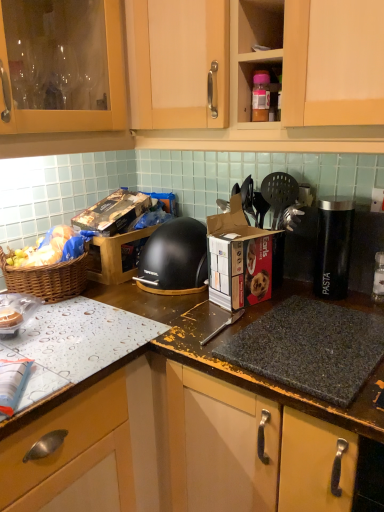
Question: Could you tell me if cardboard box at center, acting as the second cardboard box starting from the back, is facing matte wood cabinet at upper center?

Choices:
 (A) no
 (B) yes

Answer: (A)

Question: Is cardboard box at center, acting as the second cardboard box starting from the back, to the right of matte wood cabinet at upper center from the viewer's perspective?

Choices:
 (A) no
 (B) yes

Answer: (A)

Question: Is matte wood cabinet at upper center completely or partially inside cardboard box at center, which ranks as the 2th cardboard box in left-to-right order?

Choices:
 (A) yes
 (B) no

Answer: (B)

Question: Is cardboard box at center, which appears as the first cardboard box when viewed from the right, not near matte wood cabinet at upper center?

Choices:
 (A) no
 (B) yes

Answer: (A)

Question: Does cardboard box at center, which ranks as the 2th cardboard box in left-to-right order, lie in front of matte wood cabinet at upper center?

Choices:
 (A) yes
 (B) no

Answer: (B)

Question: Visually, is woven brown picnic basket at left positioned to the left or to the right of black plastic canister at right?

Choices:
 (A) right
 (B) left

Answer: (B)

Question: From the image's perspective, relative to black plastic canister at right, is woven brown picnic basket at left above or below?

Choices:
 (A) above
 (B) below

Answer: (B)

Question: From a real-world perspective, relative to black plastic canister at right, is woven brown picnic basket at left vertically above or below?

Choices:
 (A) below
 (B) above

Answer: (A)

Question: Does point (84, 274) appear closer or farther from the camera than point (329, 296)?

Choices:
 (A) closer
 (B) farther

Answer: (B)

Question: From a real-world perspective, relative to black plastic spatula at upper right, is matte wood cabinet at upper center vertically above or below?

Choices:
 (A) below
 (B) above

Answer: (B)

Question: Is matte wood cabinet at upper center taller or shorter than black plastic spatula at upper right?

Choices:
 (A) short
 (B) tall

Answer: (B)

Question: Relative to black plastic spatula at upper right, is matte wood cabinet at upper center in front or behind?

Choices:
 (A) front
 (B) behind

Answer: (A)

Question: Is matte wood cabinet at upper center bigger or smaller than black plastic spatula at upper right?

Choices:
 (A) small
 (B) big

Answer: (B)

Question: Is point (77, 269) closer or farther from the camera than point (114, 211)?

Choices:
 (A) farther
 (B) closer

Answer: (B)

Question: From a real-world perspective, relative to black cardboard box at center, marked as the first cardboard box in a back-to-front arrangement, is woven brown picnic basket at left vertically above or below?

Choices:
 (A) above
 (B) below

Answer: (A)